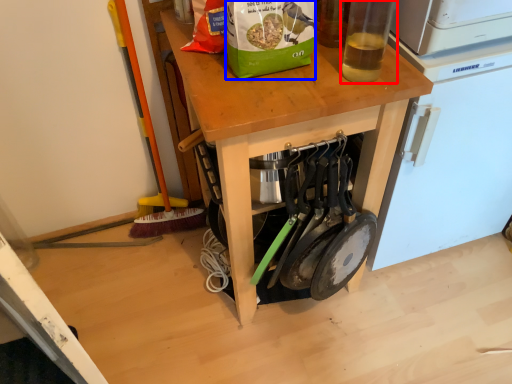
Question: Which point is closer to the camera, bottle (highlighted by a red box) or paper bag (highlighted by a blue box)?

Choices:
 (A) bottle
 (B) paper bag

Answer: (A)